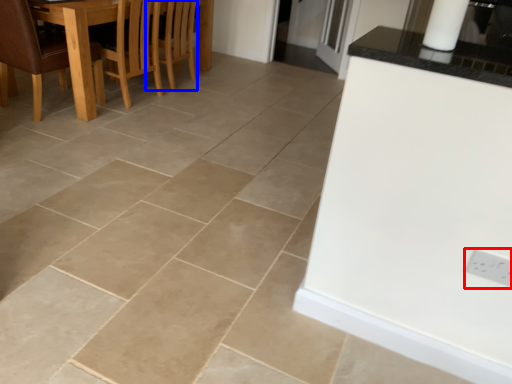
Question: Which of the following is the closest to the observer, electric outlet (highlighted by a red box) or armchair (highlighted by a blue box)?

Choices:
 (A) electric outlet
 (B) armchair

Answer: (A)